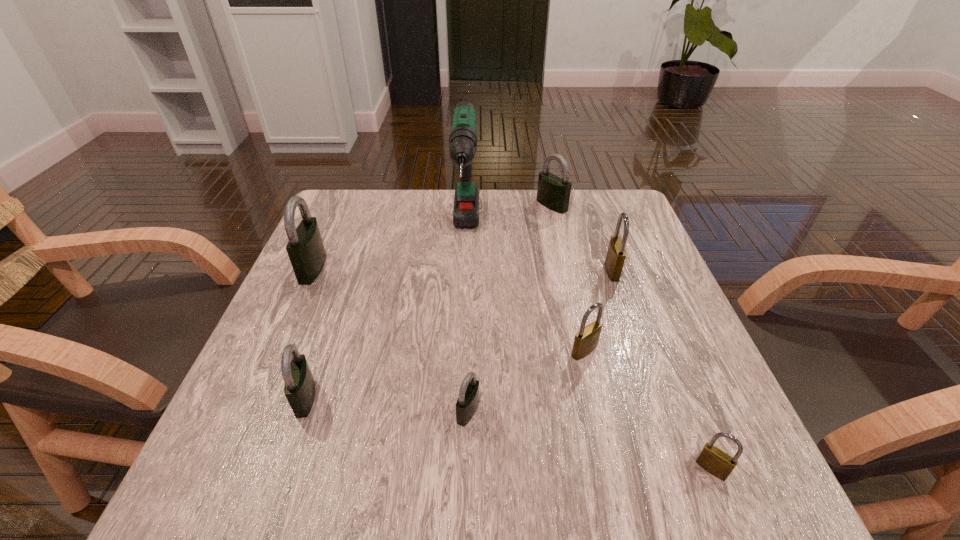
I want to click on free area in between the leftmost black padlock and the farthest black padlock, so click(x=432, y=237).

Image resolution: width=960 pixels, height=540 pixels. Find the location of `vacant space that's between the fifth padlock from right to left and the rightmost black padlock`. vacant space that's between the fifth padlock from right to left and the rightmost black padlock is located at coordinates pyautogui.click(x=510, y=308).

Locate which object ranks third in proximity to the third padlock from left to right. Please provide its 2D coordinates. Your answer should be formatted as a tuple, i.e. [(x, y)], where the tuple contains the x and y coordinates of a point satisfying the conditions above.

[(463, 140)]

Identify which object is located as the fifth nearest to the smallest black padlock. Please provide its 2D coordinates. Your answer should be formatted as a tuple, i.e. [(x, y)], where the tuple contains the x and y coordinates of a point satisfying the conditions above.

[(616, 254)]

This screenshot has height=540, width=960. In order to click on padlock object that ranks as the closest to the second padlock from left to right in this screenshot , I will do `click(468, 399)`.

Identify which padlock is the fifth closest to the sixth padlock from right to left. Please provide its 2D coordinates. Your answer should be formatted as a tuple, i.e. [(x, y)], where the tuple contains the x and y coordinates of a point satisfying the conditions above.

[(616, 254)]

In order to click on black padlock that stands as the third closest to the farthest padlock in this screenshot , I will do `click(299, 389)`.

Find the location of a particular element. The image size is (960, 540). black padlock that is the second closest to the tallest object is located at coordinates (305, 248).

The height and width of the screenshot is (540, 960). Find the location of `the second closest brass padlock relative to the tallest object`. the second closest brass padlock relative to the tallest object is located at coordinates (616, 254).

Identify which brass padlock is the second closest to the fourth nearest padlock. Please provide its 2D coordinates. Your answer should be formatted as a tuple, i.e. [(x, y)], where the tuple contains the x and y coordinates of a point satisfying the conditions above.

[(716, 462)]